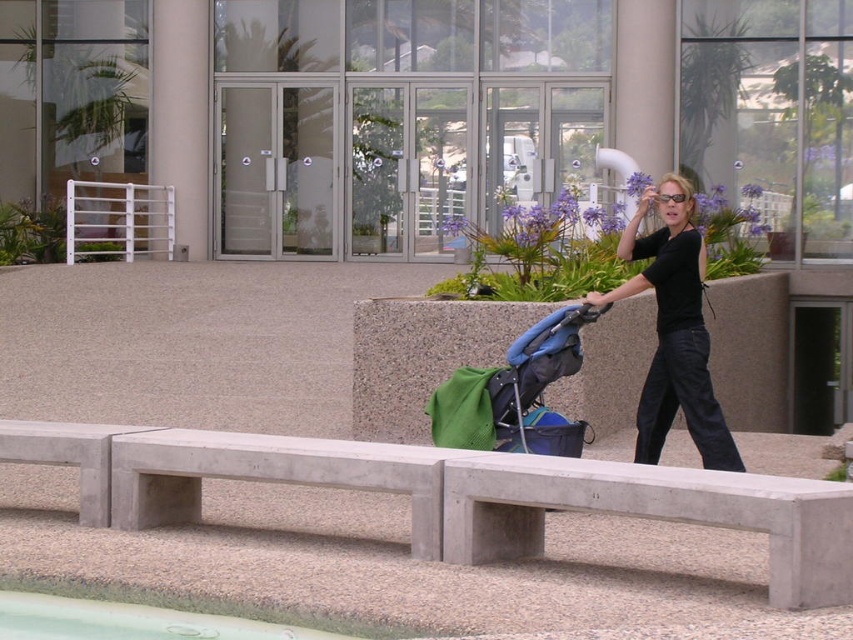
Question: In this image, where is green smooth pool at lower left located relative to white metal rail at upper left?

Choices:
 (A) right
 (B) left

Answer: (A)

Question: Based on their relative distances, which object is farther from the blue fabric stroller at center?

Choices:
 (A) black matte shirt at center
 (B) green smooth pool at lower left
 (C) white metal rail at upper left
 (D) concrete bench at lower center

Answer: (C)

Question: From the image, what is the correct spatial relationship of blue fabric stroller at center in relation to green smooth pool at lower left?

Choices:
 (A) above
 (B) below

Answer: (A)

Question: Which object is positioned closest to the green smooth pool at lower left?

Choices:
 (A) concrete bench at lower center
 (B) black matte shirt at center

Answer: (A)

Question: Which of the following is the closest to the observer?

Choices:
 (A) (82, 600)
 (B) (68, 198)
 (C) (544, 336)
 (D) (672, 243)

Answer: (A)

Question: Does black matte shirt at center appear over white metal rail at upper left?

Choices:
 (A) no
 (B) yes

Answer: (A)